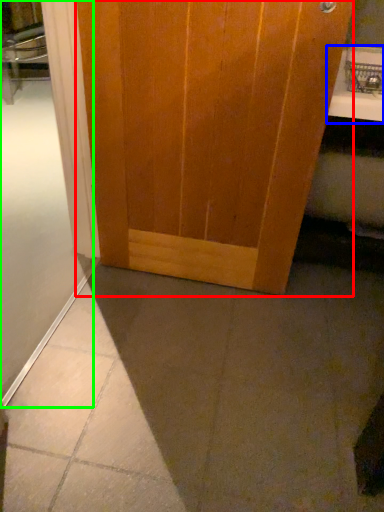
Question: Which object is the farthest from door (highlighted by a red box)? Choose among these: counter top (highlighted by a blue box) or shower door (highlighted by a green box).

Choices:
 (A) counter top
 (B) shower door

Answer: (A)